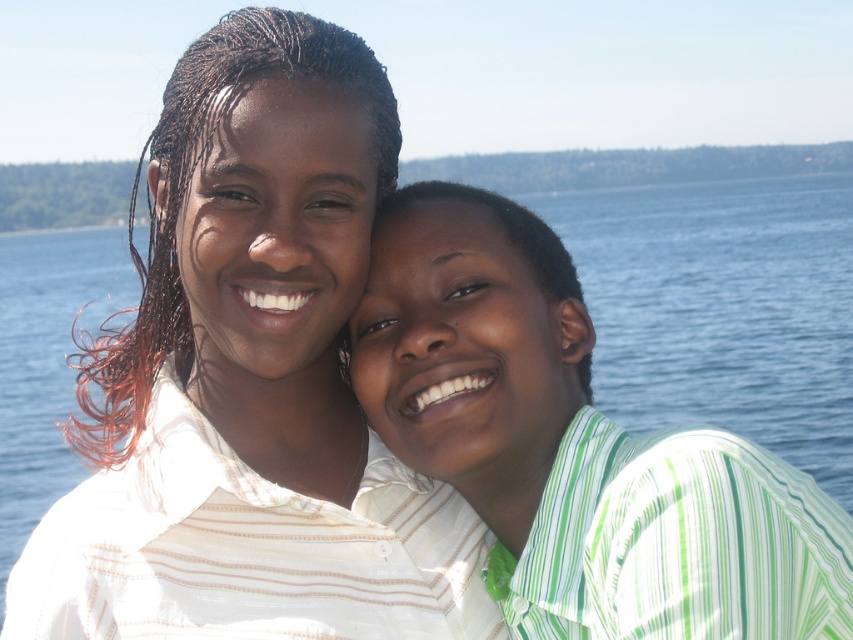
Does white striped shirt at center lie behind green striped shirt at right?

That is False.

Is white striped shirt at center smaller than green striped shirt at right?

Actually, white striped shirt at center might be larger than green striped shirt at right.

Is point (142, 291) farther from camera compared to point (675, 460)?

Yes, point (142, 291) is behind point (675, 460).

Where is `white striped shirt at center`? white striped shirt at center is located at coordinates (251, 381).